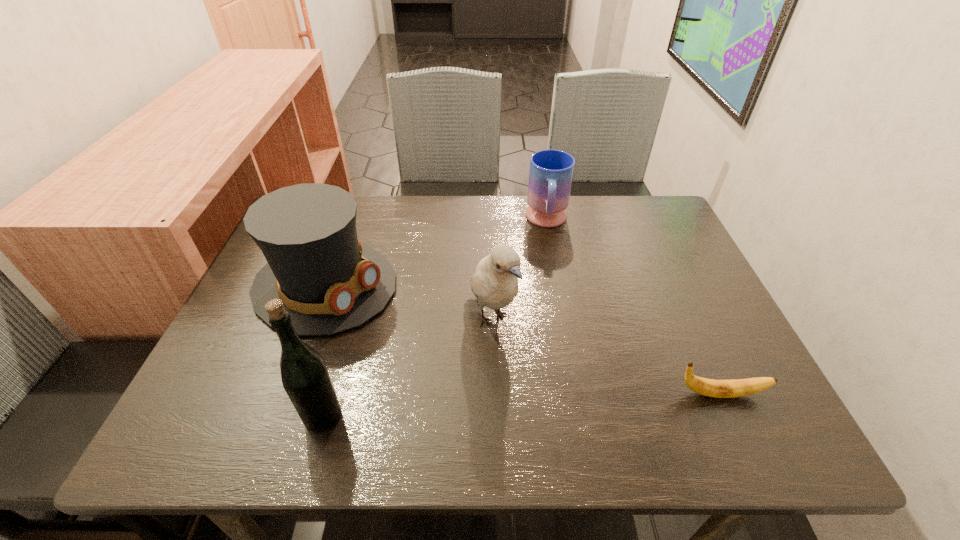
Find the location of `the tallest object`. the tallest object is located at coordinates (305, 378).

The image size is (960, 540). Find the location of `the rightmost object`. the rightmost object is located at coordinates (708, 387).

Identify the location of banana. The height and width of the screenshot is (540, 960). (708, 387).

Locate an element on the screen. This screenshot has height=540, width=960. dress hat is located at coordinates (330, 283).

Find the location of a particular element. bird is located at coordinates (494, 283).

The width and height of the screenshot is (960, 540). What are the coordinates of `the farthest object` in the screenshot? It's located at (551, 172).

Identify the location of the fourth tallest object. (551, 172).

Where is `free location located 0.200m with goggles on the front of the dress hat`? The image size is (960, 540). free location located 0.200m with goggles on the front of the dress hat is located at coordinates [x=454, y=343].

Find the location of a particular element. This screenshot has width=960, height=540. free space located with goggles on the front of the dress hat is located at coordinates (516, 372).

Image resolution: width=960 pixels, height=540 pixels. Find the location of `free location located 0.200m with goggles on the front of the dress hat`. free location located 0.200m with goggles on the front of the dress hat is located at coordinates tap(454, 343).